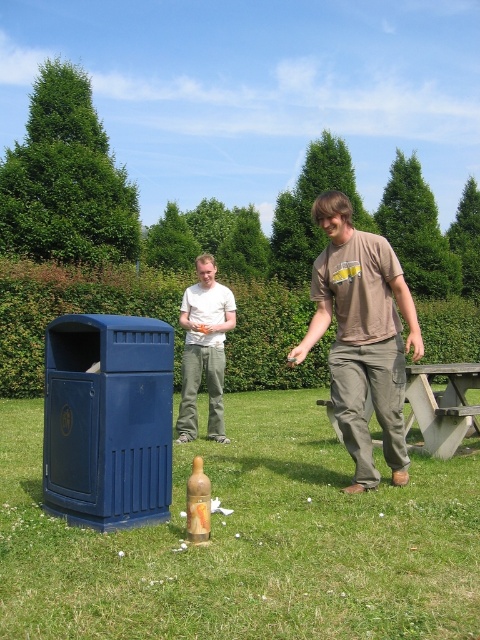
Question: Which is farther from the translucent glass bottle at center?

Choices:
 (A) brown cotton t-shirt at center
 (B) wooden picnic table at center
 (C) white cotton t-shirt at center

Answer: (C)

Question: Can you confirm if brown cotton t-shirt at center is bigger than wooden picnic table at center?

Choices:
 (A) no
 (B) yes

Answer: (B)

Question: Which object is positioned farthest from the brown cotton t-shirt at center?

Choices:
 (A) green grass at lower center
 (B) wooden picnic table at center
 (C) translucent glass bottle at center

Answer: (A)

Question: Can you confirm if green grass at lower center is positioned above brown cotton t-shirt at center?

Choices:
 (A) no
 (B) yes

Answer: (A)

Question: Is white cotton t-shirt at center thinner than wooden picnic table at center?

Choices:
 (A) yes
 (B) no

Answer: (A)

Question: Among these points, which one is nearest to the camera?

Choices:
 (A) (227, 330)
 (B) (287, 573)
 (C) (445, 417)

Answer: (B)